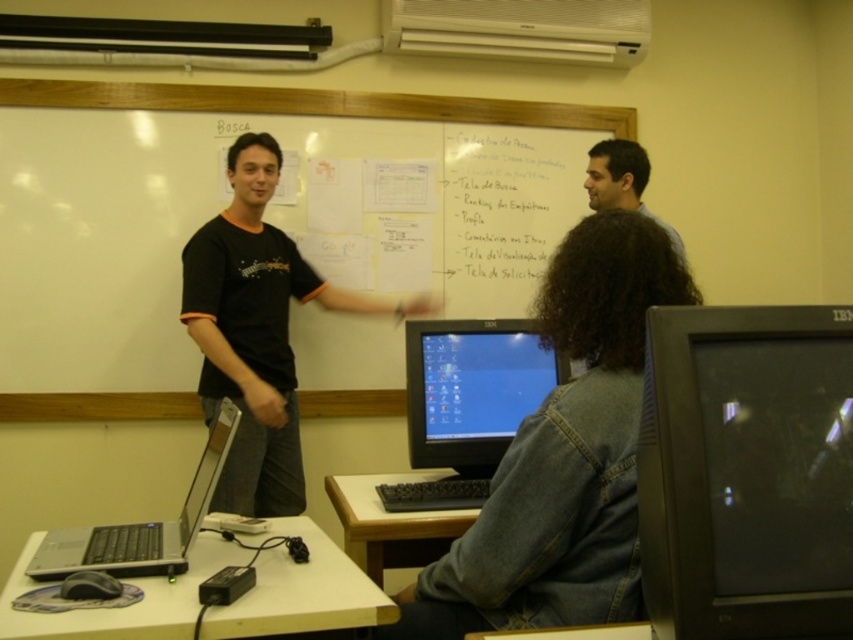
Question: Is black t-shirt at center thinner than whiteboard at upper center?

Choices:
 (A) no
 (B) yes

Answer: (B)

Question: Does black glossy monitor at lower right appear under matte black monitor at center?

Choices:
 (A) yes
 (B) no

Answer: (A)

Question: Which object is the closest to the wooden table at lower center?

Choices:
 (A) silver/black plastic laptop at lower left
 (B) matte black monitor at center
 (C) black glossy monitor at lower right
 (D) white plastic table at lower left

Answer: (B)

Question: Can you confirm if black glossy monitor at lower right is positioned above white plastic table at lower left?

Choices:
 (A) no
 (B) yes

Answer: (B)

Question: Which point is closer to the camera?

Choices:
 (A) (670, 561)
 (B) (381, 508)
 (C) (19, 592)

Answer: (A)

Question: Which point is closer to the camera?

Choices:
 (A) (605, 152)
 (B) (236, 486)
 (C) (769, 440)

Answer: (C)